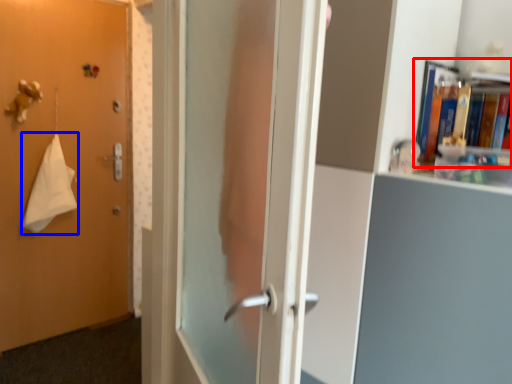
Question: Which object appears farthest to the camera in this image, book (highlighted by a red box) or bath towel (highlighted by a blue box)?

Choices:
 (A) book
 (B) bath towel

Answer: (B)